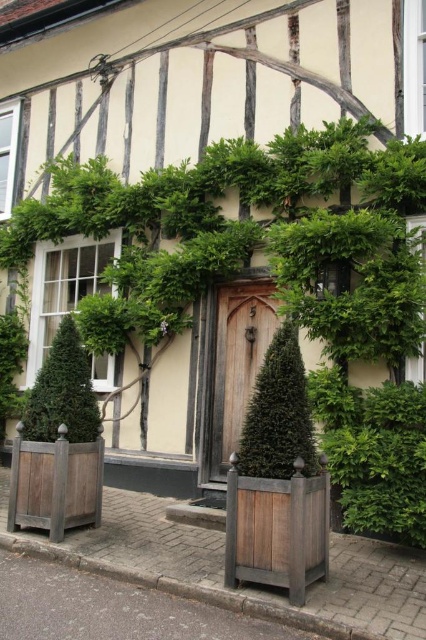
Question: Does wooden door at center appear on the left side of green coniferous tree at left?

Choices:
 (A) no
 (B) yes

Answer: (A)

Question: Among these objects, which one is nearest to the camera?

Choices:
 (A) green textured cone at center
 (B) wooden door at center
 (C) green coniferous tree at left

Answer: (A)

Question: Which object appears closest to the camera in this image?

Choices:
 (A) wooden door at center
 (B) green coniferous tree at left

Answer: (B)

Question: Which point is farther from the camera taking this photo?

Choices:
 (A) (51, 380)
 (B) (282, 397)

Answer: (A)

Question: Is wooden door at center below green coniferous tree at left?

Choices:
 (A) yes
 (B) no

Answer: (A)

Question: Considering the relative positions of wooden door at center and green coniferous tree at left in the image provided, where is wooden door at center located with respect to green coniferous tree at left?

Choices:
 (A) left
 (B) right

Answer: (B)